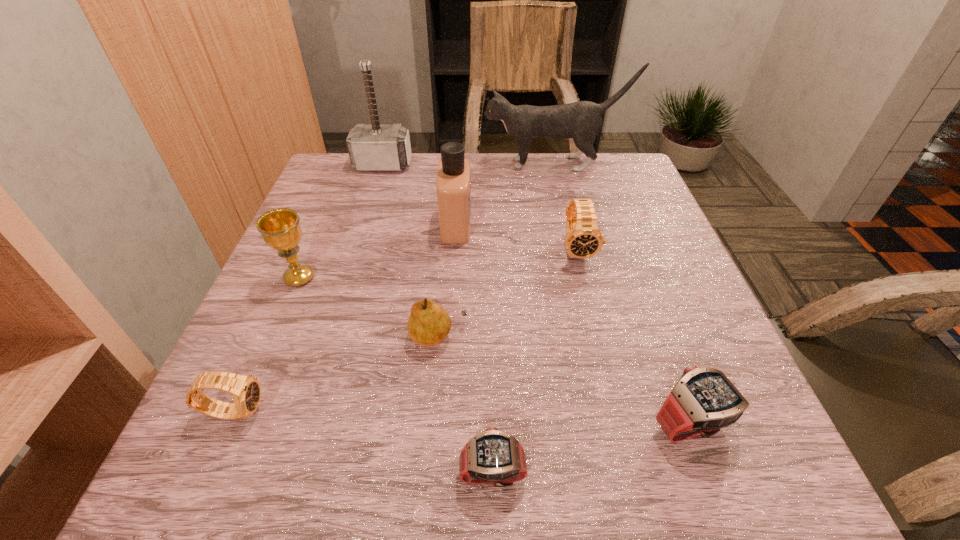
Where is `the rightmost watch`? This screenshot has height=540, width=960. the rightmost watch is located at coordinates (704, 400).

The image size is (960, 540). What are the coordinates of `the leftmost watch` in the screenshot? It's located at (246, 391).

The image size is (960, 540). I want to click on the nearer black watch, so click(x=246, y=391).

Locate an element on the screen. The image size is (960, 540). the third watch from right to left is located at coordinates (494, 457).

Identify the location of the shortest object. Image resolution: width=960 pixels, height=540 pixels. (494, 457).

Locate an element on the screen. This screenshot has height=540, width=960. free space located 0.100m for striking with the head of the hammer is located at coordinates (373, 195).

Find the location of a particular element. vacant region located 0.120m at the face of the cat is located at coordinates (440, 164).

This screenshot has width=960, height=540. What are the coordinates of `vacant space located at the face of the cat` in the screenshot? It's located at (411, 164).

At what (x,y) coordinates should I click in order to perform the action: click on vacant area located 0.130m at the face of the cat. Please return your answer as a coordinate pair (x, y). This screenshot has width=960, height=540. Looking at the image, I should click on (437, 164).

Image resolution: width=960 pixels, height=540 pixels. I want to click on vacant space located 0.180m on the front label of the beige perfume, so click(549, 225).